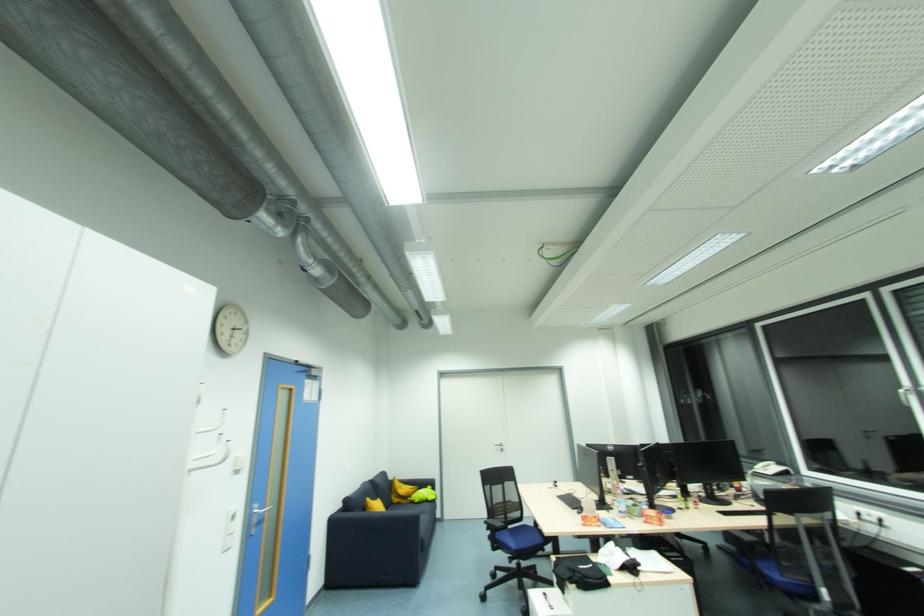
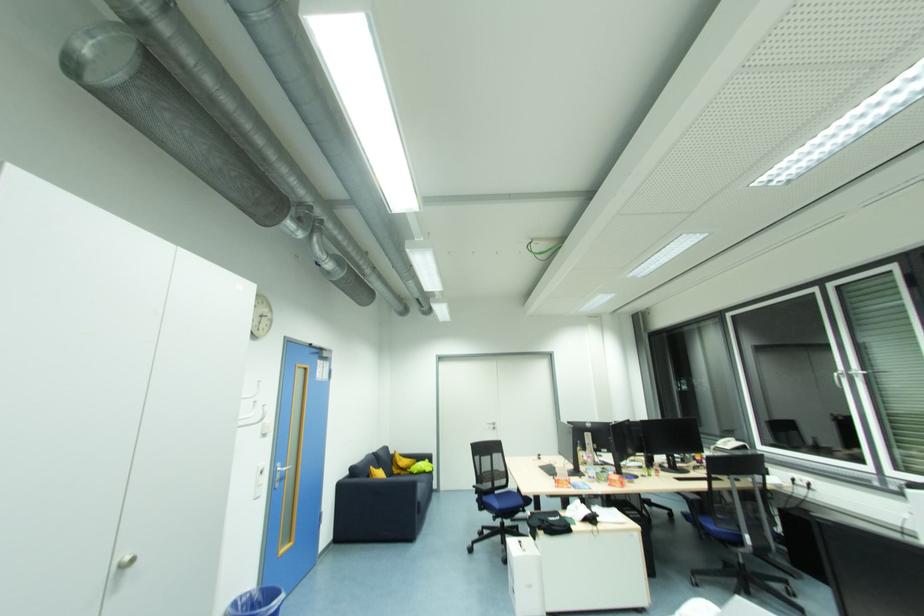
Where in the second image is the point corresponding to [786,469] from the first image?

(745, 446)